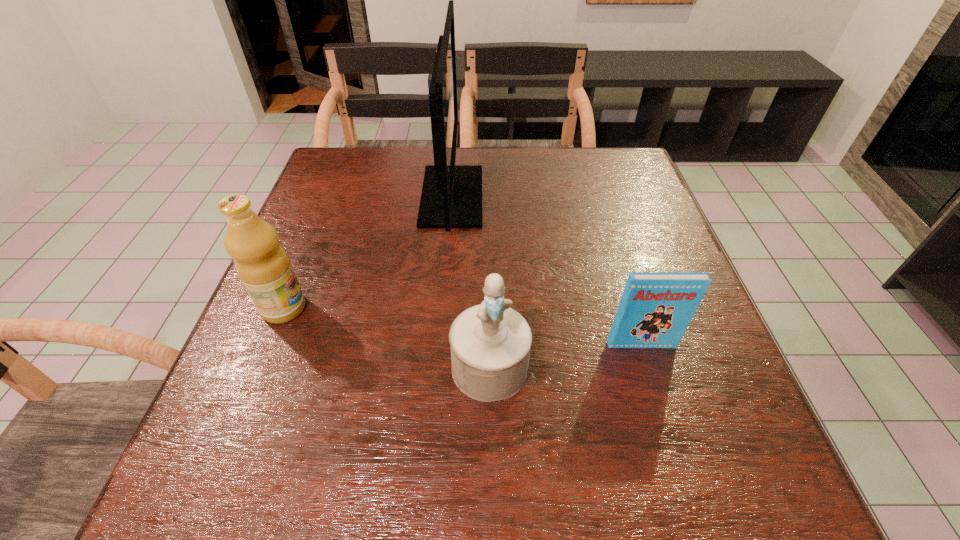
Choose which object is the third nearest neighbor to the tallest object. Please provide its 2D coordinates. Your answer should be formatted as a tuple, i.e. [(x, y)], where the tuple contains the x and y coordinates of a point satisfying the conditions above.

[(655, 309)]

Point out which object is positioned as the third nearest to the rightmost object. Please provide its 2D coordinates. Your answer should be formatted as a tuple, i.e. [(x, y)], where the tuple contains the x and y coordinates of a point satisfying the conditions above.

[(262, 264)]